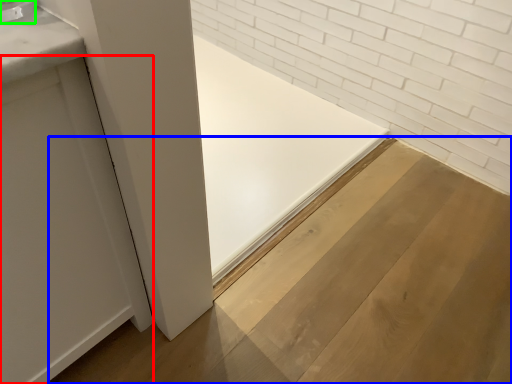
Question: Considering the real-world distances, which object is closest to door (highlighted by a red box)? plywood (highlighted by a blue box) or faucet (highlighted by a green box).

Choices:
 (A) plywood
 (B) faucet

Answer: (B)